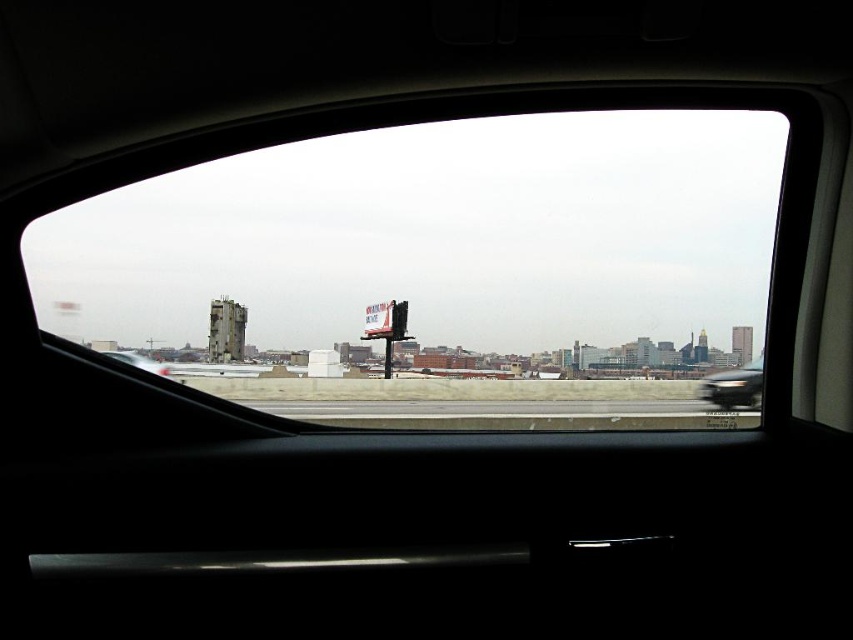
You are a passenger in the car and want to see the billboard advertisement clearly. The transparent glass windshield at center and the metallic silver sedan at lower right are in your line of sight. Which object is taller and might block your view of the billboard?

The transparent glass windshield at center is much taller than the metallic silver sedan at lower right, so it might block your view of the billboard.

You are sitting in the back seat of a car and looking out the rear window. You see two points marked on the window at coordinates point (357, 404) and point (724, 392). Which point is closer to you?

Point (357, 404) is closer to the viewer than point (724, 392).